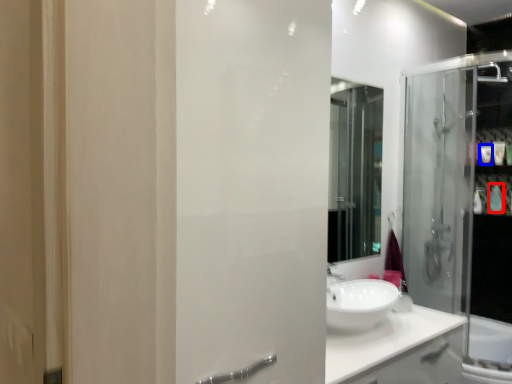
Question: Among these objects, which one is nearest to the camera, toiletry (highlighted by a red box) or toiletry (highlighted by a blue box)?

Choices:
 (A) toiletry
 (B) toiletry

Answer: (A)